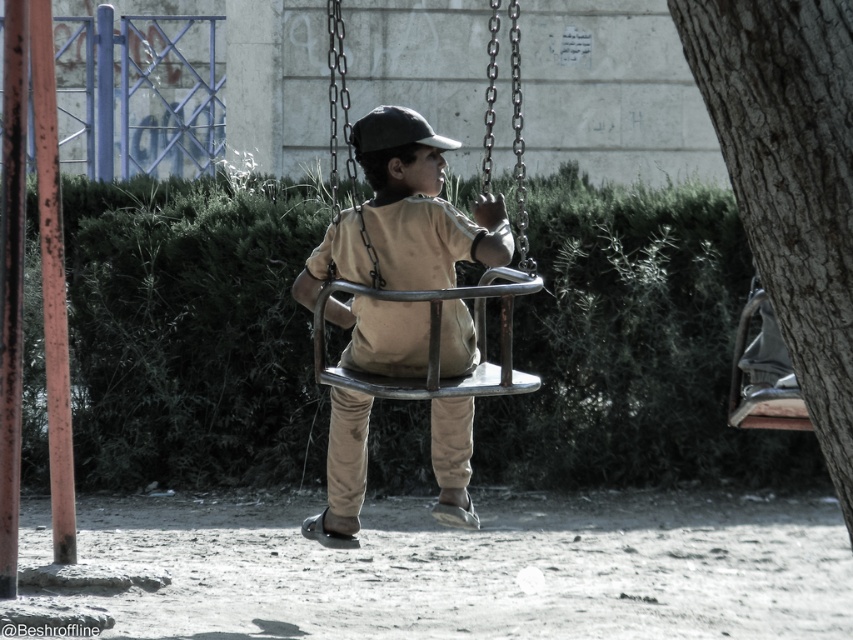
Who is shorter, matte brown swing at center or metallic swing at center?

matte brown swing at center

Is matte brown swing at center to the right of metallic swing at center from the viewer's perspective?

In fact, matte brown swing at center is to the left of metallic swing at center.

Identify the location of matte brown swing at center. (421, 204).

Which of these two, matte brown swing at center or black matte baseball hat at center, stands taller?

Standing taller between the two is matte brown swing at center.

I want to click on matte brown swing at center, so coord(421,204).

In order to click on matte brown swing at center in this screenshot , I will do `click(421, 204)`.

Which of these two, metallic swing at center or black matte baseball hat at center, stands taller?

With more height is metallic swing at center.

Is point (390, 380) closer to viewer compared to point (387, 129)?

No, it is not.

Is point (469, 385) less distant than point (419, 122)?

Yes.

Where is `metallic swing at center`? metallic swing at center is located at coordinates (461, 298).